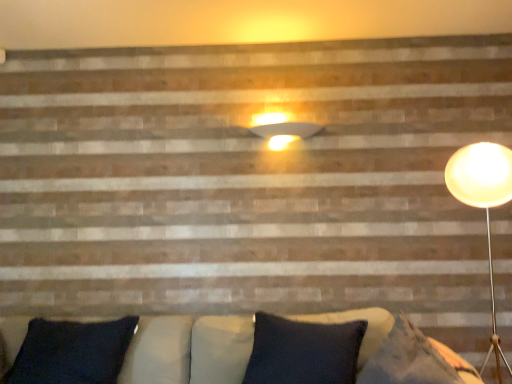
Question: Is dark blue fabric pillow at lower left bigger or smaller than matte white wall sconce at upper center?

Choices:
 (A) small
 (B) big

Answer: (B)

Question: From a real-world perspective, is dark blue fabric pillow at lower left above or below matte white wall sconce at upper center?

Choices:
 (A) below
 (B) above

Answer: (A)

Question: In the image, is dark blue fabric pillow at lower left positioned in front of or behind matte white wall sconce at upper center?

Choices:
 (A) front
 (B) behind

Answer: (A)

Question: Considering the positions of matte white wall sconce at upper center and dark blue fabric pillow at lower left in the image, is matte white wall sconce at upper center taller or shorter than dark blue fabric pillow at lower left?

Choices:
 (A) tall
 (B) short

Answer: (B)

Question: Is matte white wall sconce at upper center inside the boundaries of dark blue fabric pillow at lower left, or outside?

Choices:
 (A) outside
 (B) inside

Answer: (A)

Question: Considering the relative positions of matte white wall sconce at upper center and dark blue fabric pillow at lower left in the image provided, is matte white wall sconce at upper center to the left or to the right of dark blue fabric pillow at lower left?

Choices:
 (A) left
 (B) right

Answer: (B)

Question: Is matte white wall sconce at upper center in front of or behind dark blue fabric pillow at lower left in the image?

Choices:
 (A) behind
 (B) front

Answer: (A)